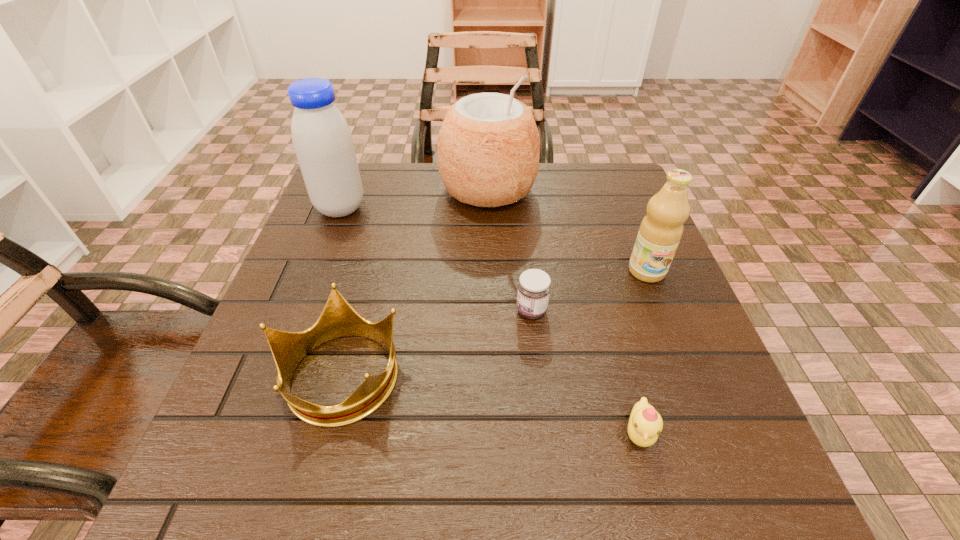
The width and height of the screenshot is (960, 540). I want to click on olive oil that is at the right edge, so click(660, 232).

Locate an element on the screen. duckling that is at the right edge is located at coordinates (645, 424).

The width and height of the screenshot is (960, 540). Identify the location of object that is at the far left corner. (322, 140).

At what (x,y) coordinates should I click in order to perform the action: click on object that is at the near right corner. Please return your answer as a coordinate pair (x, y). Looking at the image, I should click on (645, 424).

Locate an element on the screen. The image size is (960, 540). vacant space at the far edge of the desktop is located at coordinates (449, 199).

In the image, there is a desktop. Where is `vacant area at the near edge`? Image resolution: width=960 pixels, height=540 pixels. vacant area at the near edge is located at coordinates pos(318,512).

The image size is (960, 540). Find the location of `free space at the right edge`. free space at the right edge is located at coordinates (650, 329).

Find the location of `free space at the far left corner`. free space at the far left corner is located at coordinates (363, 212).

The image size is (960, 540). I want to click on vacant area at the far right corner of the desktop, so click(610, 213).

Where is `free space between the jam and the soya milk`? This screenshot has width=960, height=540. free space between the jam and the soya milk is located at coordinates (436, 259).